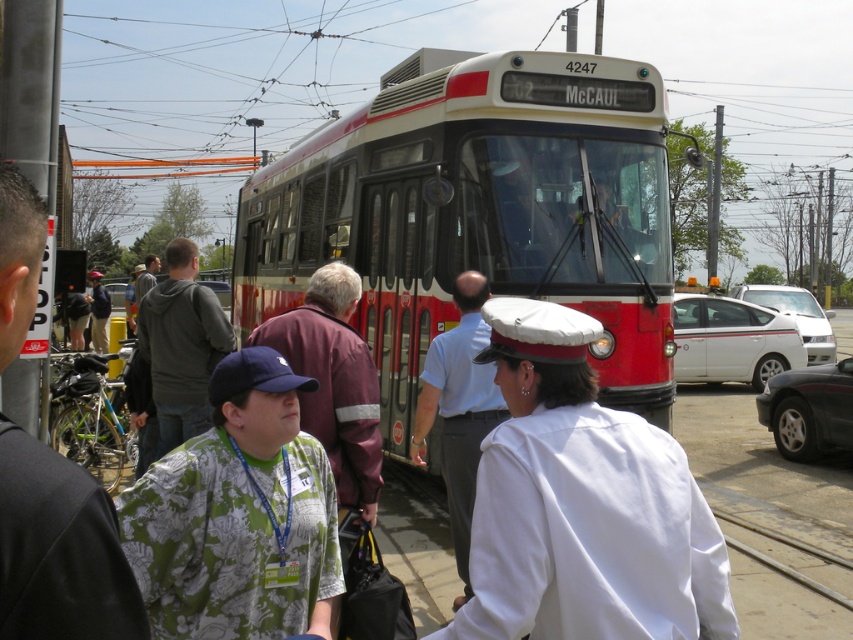
Question: Is white cotton cap at center positioned behind green printed shirt at center?

Choices:
 (A) no
 (B) yes

Answer: (A)

Question: Is green printed shirt at center below green camouflage shirt at left?

Choices:
 (A) yes
 (B) no

Answer: (A)

Question: Which of the following is the closest to the observer?

Choices:
 (A) white cotton cap at center
 (B) white uniform at center
 (C) dark gray hoodie at center

Answer: (A)

Question: Can you confirm if green printed shirt at center is wider than green camouflage shirt at left?

Choices:
 (A) yes
 (B) no

Answer: (A)

Question: Which point is farther to the camera?

Choices:
 (A) green camouflage shirt at left
 (B) red polished metal bus at center
 (C) white uniform at center

Answer: (C)

Question: Estimate the real-world distances between objects in this image. Which object is closer to the red polished metal bus at center?

Choices:
 (A) white cotton cap at center
 (B) white uniform at center
 (C) green camouflage shirt at left
 (D) dark gray hoodie at center

Answer: (B)